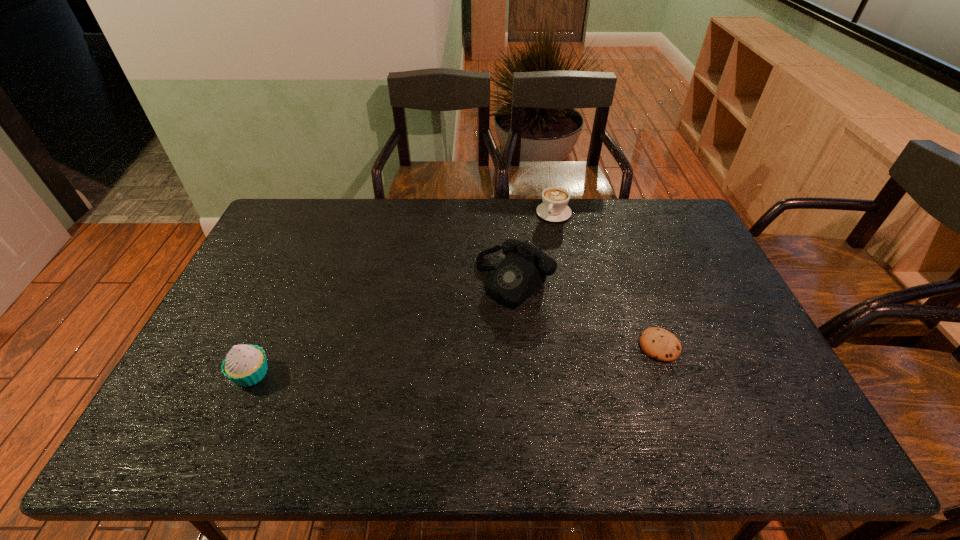
You are a GUI agent. You are given a task and a screenshot of the screen. Output one action in this format:
    pyautogui.click(x=<x>, y=<y>)
    Task: Click on the cupcake
    The height and width of the screenshot is (540, 960).
    Given the screenshot: What is the action you would take?
    pyautogui.click(x=245, y=365)

In order to click on the rightmost object in this screenshot , I will do `click(658, 343)`.

Locate an element on the screen. This screenshot has height=540, width=960. the shortest object is located at coordinates (658, 343).

Locate an element on the screen. Image resolution: width=960 pixels, height=540 pixels. the third nearest object is located at coordinates (523, 271).

Find the location of `the second shortest object`. the second shortest object is located at coordinates (554, 208).

You are a GUI agent. You are given a task and a screenshot of the screen. Output one action in this format:
    pyautogui.click(x=<x>, y=<y>)
    Task: Click on the cappuccino
    The width and height of the screenshot is (960, 540).
    Given the screenshot: What is the action you would take?
    pyautogui.click(x=554, y=208)

You are a GUI agent. You are given a task and a screenshot of the screen. Output one action in this format:
    pyautogui.click(x=<x>, y=<y>)
    Task: Click on the vacant space situated 0.090m on the left of the leftmost object
    This screenshot has width=960, height=540.
    Given the screenshot: What is the action you would take?
    pyautogui.click(x=196, y=374)

The width and height of the screenshot is (960, 540). In order to click on free spot located 0.260m on the back of the rightmost object in this screenshot , I will do `click(631, 266)`.

This screenshot has width=960, height=540. I want to click on blank area located 0.290m on the dial of the second farthest object, so click(x=420, y=367).

Image resolution: width=960 pixels, height=540 pixels. I want to click on vacant space situated 0.130m on the dial of the second farthest object, so click(462, 329).